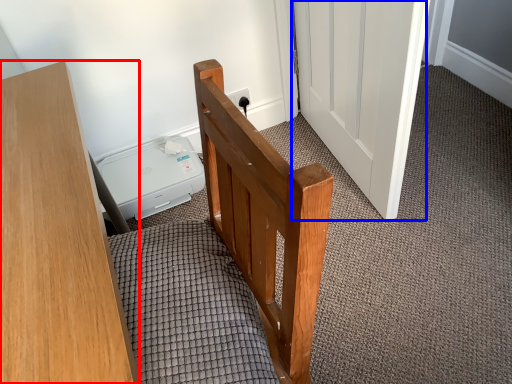
Question: Which object appears closest to the camera in this image, furniture (highlighted by a red box) or door (highlighted by a blue box)?

Choices:
 (A) furniture
 (B) door

Answer: (A)